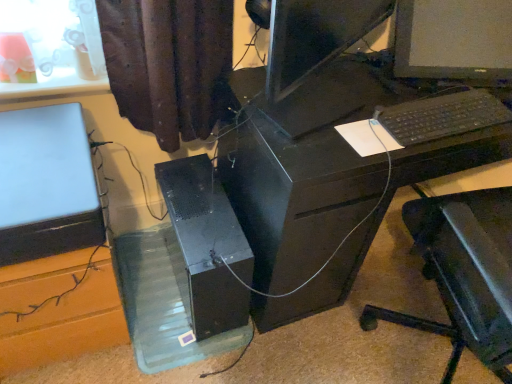
Find the location of a particular element. vacant space behind black plastic keyboard at right is located at coordinates (415, 79).